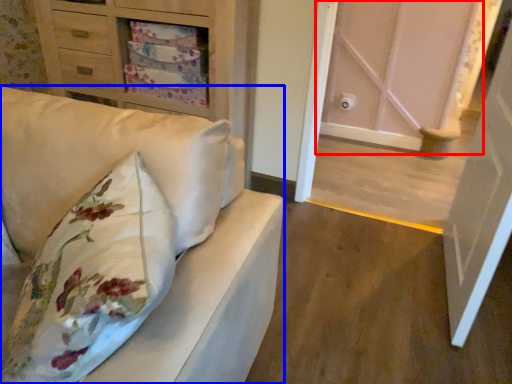
Question: Among these objects, which one is farthest to the camera, door (highlighted by a red box) or furniture (highlighted by a blue box)?

Choices:
 (A) door
 (B) furniture

Answer: (A)